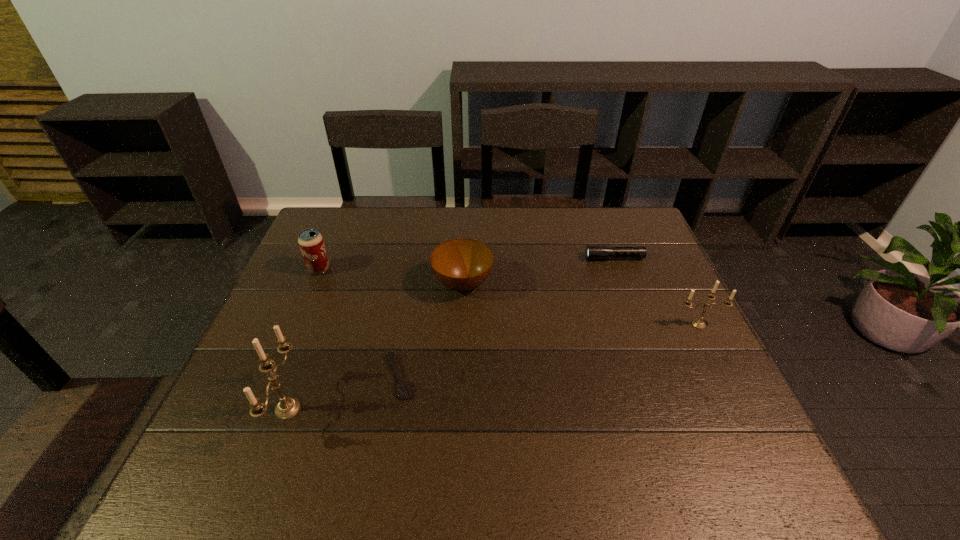
This screenshot has width=960, height=540. Identify the location of flashlight. (593, 252).

Identify the location of the second shortest object. (593, 252).

Find the location of a particular element. This screenshot has width=960, height=540. vacant region located 0.110m on the right of the nearer candle is located at coordinates (350, 409).

This screenshot has width=960, height=540. In order to click on free space located on the back of the farther candle in this screenshot , I will do `click(672, 273)`.

The width and height of the screenshot is (960, 540). I want to click on vacant area located on the right of the beer can, so click(x=427, y=269).

Find the location of `free space located on the right of the fourth object from left to right`. free space located on the right of the fourth object from left to right is located at coordinates (556, 284).

I want to click on vacant space situated 0.150m on the back of the shortest object, so click(x=411, y=310).

Find the location of a particular element. This screenshot has width=960, height=540. vacant position located at the lens end of the fifth object from left to right is located at coordinates (524, 258).

Identify the location of free space located 0.290m at the lens end of the fifth object from left to right. The height and width of the screenshot is (540, 960). (492, 258).

You are a GUI agent. You are given a task and a screenshot of the screen. Output one action in this format:
    pyautogui.click(x=<x>, y=<y>)
    Task: Click on the free region located 0.110m at the lens end of the fifth object from left to right
    The height and width of the screenshot is (540, 960).
    Given the screenshot: What is the action you would take?
    pyautogui.click(x=550, y=258)